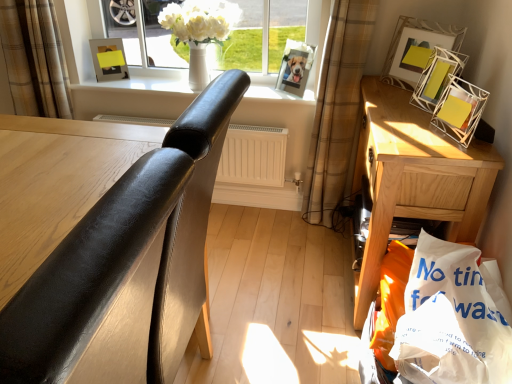
Question: Is metallic silver picture frame at upper right, positioned as the second picture frame in right-to-left order, not close to white wire mesh picture frame at upper right, positioned as the 4th picture frame in left-to-right order?

Choices:
 (A) yes
 (B) no

Answer: (B)

Question: Is metallic silver picture frame at upper right, which is counted as the 3th picture frame, starting from the left, wider than white wire mesh picture frame at upper right, positioned as the 4th picture frame in left-to-right order?

Choices:
 (A) yes
 (B) no

Answer: (B)

Question: From the image's perspective, is metallic silver picture frame at upper right, positioned as the second picture frame in right-to-left order, located beneath white wire mesh picture frame at upper right, acting as the first picture frame starting from the right?

Choices:
 (A) yes
 (B) no

Answer: (B)

Question: Can you confirm if metallic silver picture frame at upper right, which is counted as the 3th picture frame, starting from the left, is positioned to the left of white wire mesh picture frame at upper right, acting as the first picture frame starting from the right?

Choices:
 (A) yes
 (B) no

Answer: (A)

Question: Is metallic silver picture frame at upper right, positioned as the second picture frame in right-to-left order, shorter than white wire mesh picture frame at upper right, acting as the first picture frame starting from the right?

Choices:
 (A) yes
 (B) no

Answer: (B)

Question: Is metallic silver picture frame at upper right, which is counted as the 3th picture frame, starting from the left, thinner than white wire mesh picture frame at upper right, acting as the first picture frame starting from the right?

Choices:
 (A) no
 (B) yes

Answer: (B)

Question: Does white matte radiator at center come behind white paper shopping bag at lower right?

Choices:
 (A) yes
 (B) no

Answer: (A)

Question: Considering the relative sizes of white matte radiator at center and white paper shopping bag at lower right in the image provided, is white matte radiator at center smaller than white paper shopping bag at lower right?

Choices:
 (A) no
 (B) yes

Answer: (A)

Question: Does white matte radiator at center lie in front of white paper shopping bag at lower right?

Choices:
 (A) no
 (B) yes

Answer: (A)

Question: Does white matte radiator at center have a larger size compared to white paper shopping bag at lower right?

Choices:
 (A) no
 (B) yes

Answer: (B)

Question: From a real-world perspective, does white matte radiator at center sit lower than white paper shopping bag at lower right?

Choices:
 (A) no
 (B) yes

Answer: (B)

Question: From the image's perspective, is white matte radiator at center on white paper shopping bag at lower right?

Choices:
 (A) no
 (B) yes

Answer: (B)

Question: Is black leather chair at left inside wooden nightstand at right?

Choices:
 (A) yes
 (B) no

Answer: (B)